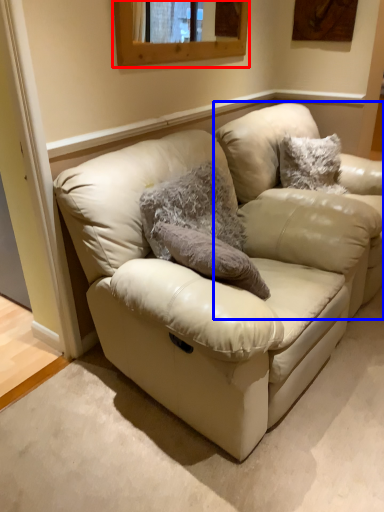
Question: Which object is further to the camera taking this photo, window (highlighted by a red box) or swivel chair (highlighted by a blue box)?

Choices:
 (A) window
 (B) swivel chair

Answer: (B)